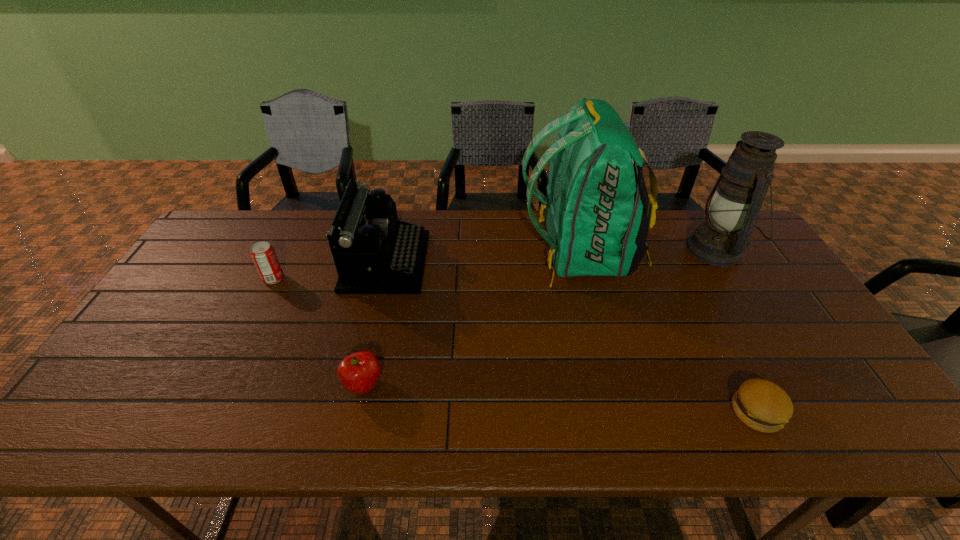
Find the location of `object present at the far right corner`. object present at the far right corner is located at coordinates (734, 203).

Image resolution: width=960 pixels, height=540 pixels. I want to click on vacant space at the far edge of the desktop, so click(290, 248).

Identify the location of vacant space at the near edge of the desktop. The image size is (960, 540). (310, 417).

Image resolution: width=960 pixels, height=540 pixels. I want to click on blank space at the right edge of the desktop, so click(x=748, y=282).

Image resolution: width=960 pixels, height=540 pixels. I want to click on blank area at the far left corner, so click(x=251, y=231).

The image size is (960, 540). Identify the location of vacant space at the near right corner of the desktop. (855, 418).

Where is `free space between the third object from right to left and the leftmost object`? This screenshot has height=540, width=960. free space between the third object from right to left and the leftmost object is located at coordinates (427, 265).

The height and width of the screenshot is (540, 960). Find the location of `vacant point located between the apple and the soda can`. vacant point located between the apple and the soda can is located at coordinates (319, 332).

You are a GUI agent. You are given a task and a screenshot of the screen. Output one action in this format:
    pyautogui.click(x=<x>, y=<y>)
    Task: Click on the free spot between the fifth shortest object and the soda can
    
    Given the screenshot: What is the action you would take?
    pyautogui.click(x=494, y=264)

Where is `vacant point located between the oil lamp and the fourth object from left to right`? The height and width of the screenshot is (540, 960). vacant point located between the oil lamp and the fourth object from left to right is located at coordinates (648, 251).